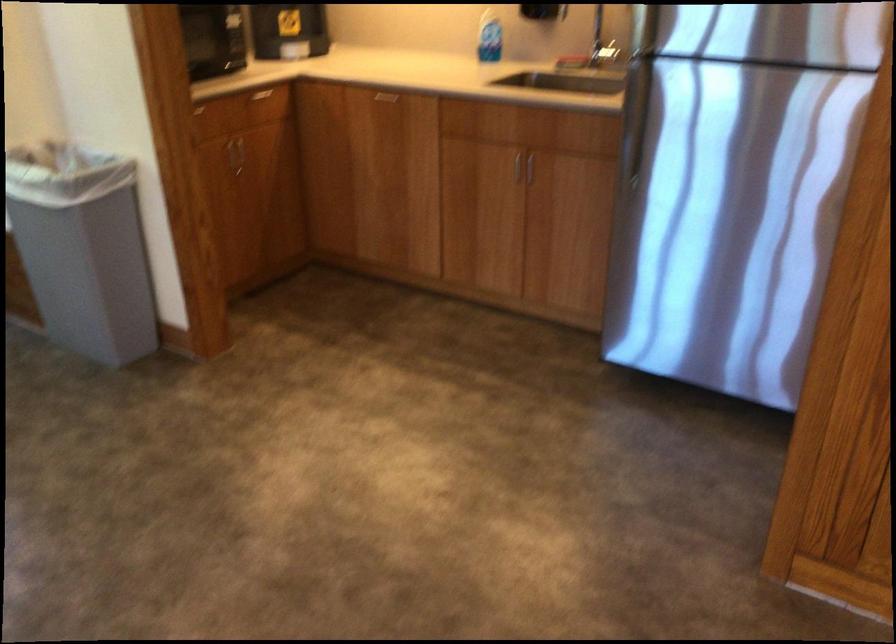
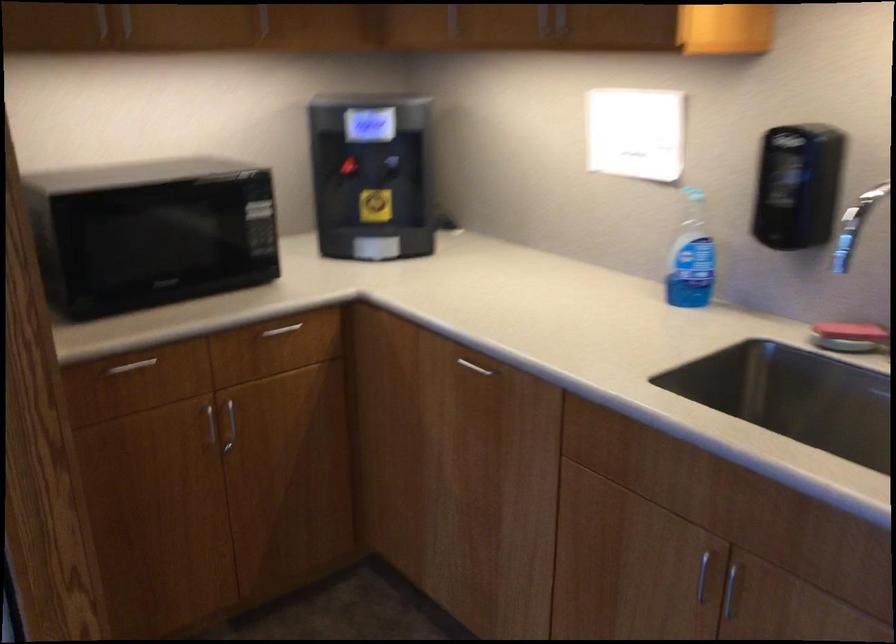
Question: In a continuous first-person perspective shot, in which direction is the camera moving?

Choices:
 (A) Left
 (B) Right
 (C) Forward
 (D) Backward

Answer: (C)